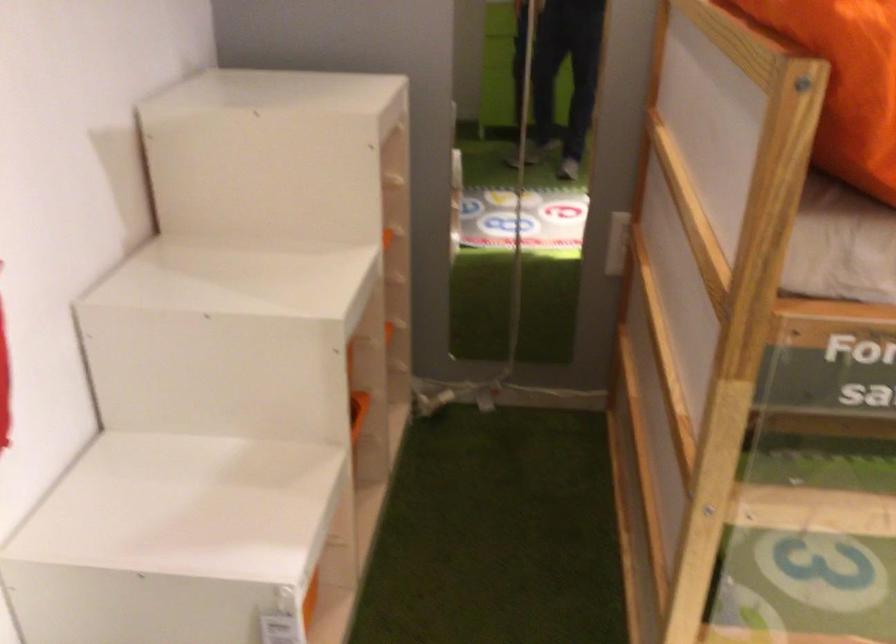
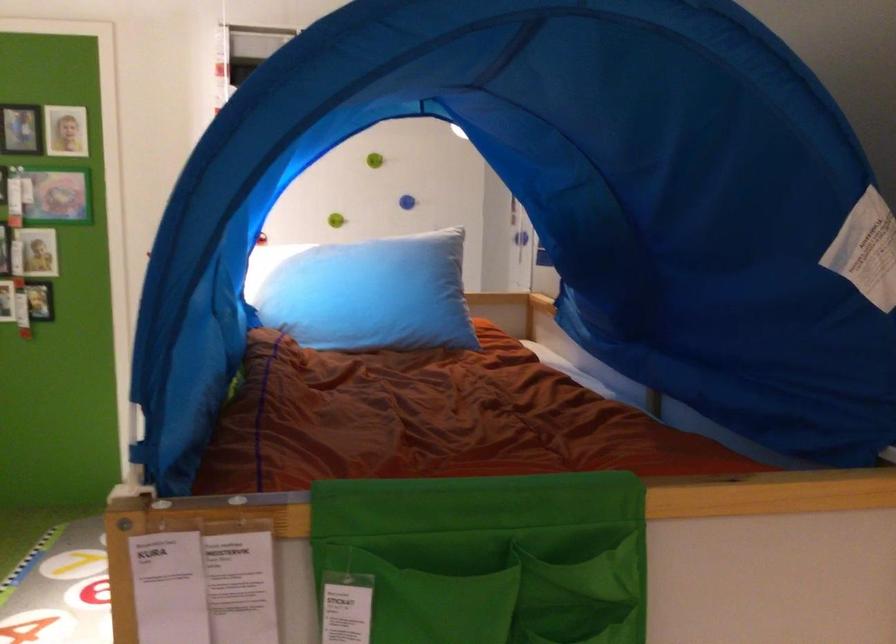
Question: I am providing you with two images of the same scene from different viewpoints. Please identify which objects are invisible in image2.

Choices:
 (A) wooden ladder rung
 (B) wooden bath caddy
 (C) blue wall knob
 (D) light blue pillow

Answer: (A)